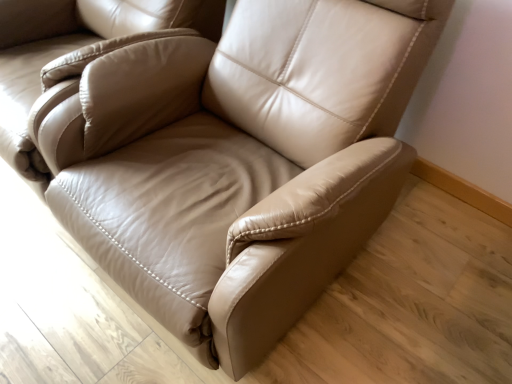
From the picture: Measure the distance between point (67, 37) and camera.

They are 5.23 feet apart.

What is the approximate width of beige leather swivel chair at center?

beige leather swivel chair at center is 38.18 inches wide.

You are a GUI agent. You are given a task and a screenshot of the screen. Output one action in this format:
    pyautogui.click(x=<x>, y=<y>)
    Task: Click on the beige leather swivel chair at center
    
    Given the screenshot: What is the action you would take?
    pyautogui.click(x=98, y=75)

The width and height of the screenshot is (512, 384). What do you see at coordinates (98, 75) in the screenshot? I see `beige leather swivel chair at center` at bounding box center [98, 75].

What are the coordinates of `beige leather swivel chair at center` in the screenshot? It's located at (98, 75).